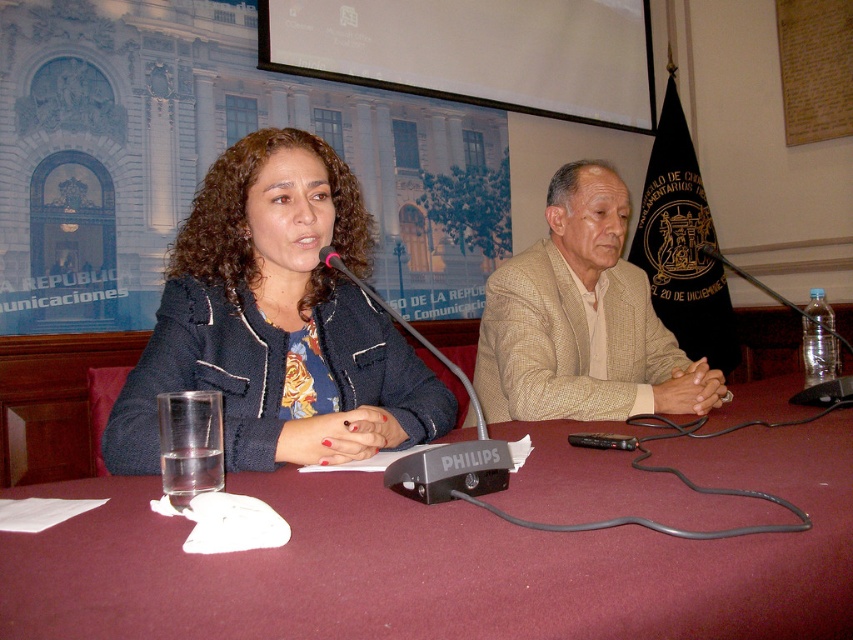
You are attending a virtual meeting and need to focus on the speaker. The maroon fabric table at center and the matte black jacket at center are both in your view. Which object is closer to you, the viewer?

The maroon fabric table at center is closer to the viewer than the matte black jacket at center.

You are a photographer setting up for a press conference. You need to place a small podium between the matte black jacket at center and the beige textured blazer at center. Based on their positions, where should you place the podium so it is between them?

The podium should be placed between the matte black jacket at center and the beige textured blazer at center. Since the matte black jacket at center is above the beige textured blazer at center, the podium should be placed below the matte black jacket at center and above the beige textured blazer at center to be between them.

You are an event organizer setting up a conference room. You have a maroon fabric table at center and a beige textured blazer at center. Which object is shorter?

The maroon fabric table at center has a lesser height compared to the beige textured blazer at center, so the maroon fabric table at center is shorter.